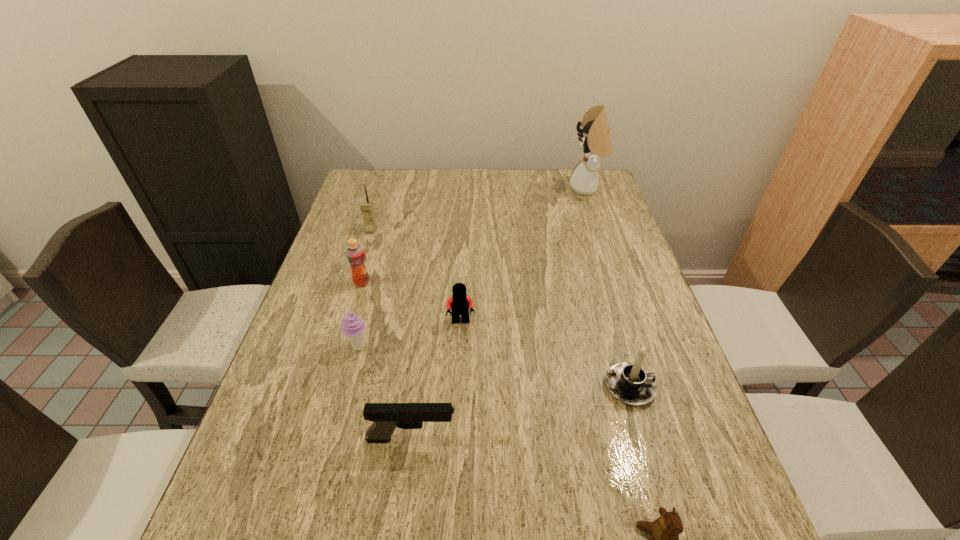
You are a GUI agent. You are given a task and a screenshot of the screen. Output one action in this format:
    pyautogui.click(x=<x>, y=<y>)
    Task: Click on the vacant space situated 0.130m at the front face of the tallest object
    
    Given the screenshot: What is the action you would take?
    pyautogui.click(x=533, y=188)

The height and width of the screenshot is (540, 960). I want to click on vacant space located on the front of the cellular telephone, where the keypad is located, so click(x=358, y=270).

The width and height of the screenshot is (960, 540). What are the coordinates of `free space located on the back of the sixth nearest object` in the screenshot? It's located at (375, 235).

Locate an element on the screen. The image size is (960, 540). free point located with a handle on the side of the candle holder is located at coordinates (684, 387).

Where is `blank area located 0.370m on the front-facing side of the Lego`? The width and height of the screenshot is (960, 540). blank area located 0.370m on the front-facing side of the Lego is located at coordinates (454, 483).

The image size is (960, 540). I want to click on free space located 0.120m on the front of the fifth farthest object, so click(x=345, y=403).

Where is `vacant space situated 0.140m on the front-facing side of the pistol`? The image size is (960, 540). vacant space situated 0.140m on the front-facing side of the pistol is located at coordinates (528, 438).

Where is `object positioned at the far edge`? This screenshot has height=540, width=960. object positioned at the far edge is located at coordinates (595, 140).

This screenshot has width=960, height=540. Identify the location of cellular telephone present at the left edge. (366, 207).

This screenshot has height=540, width=960. Identify the location of orange juice that is at the left edge. (355, 255).